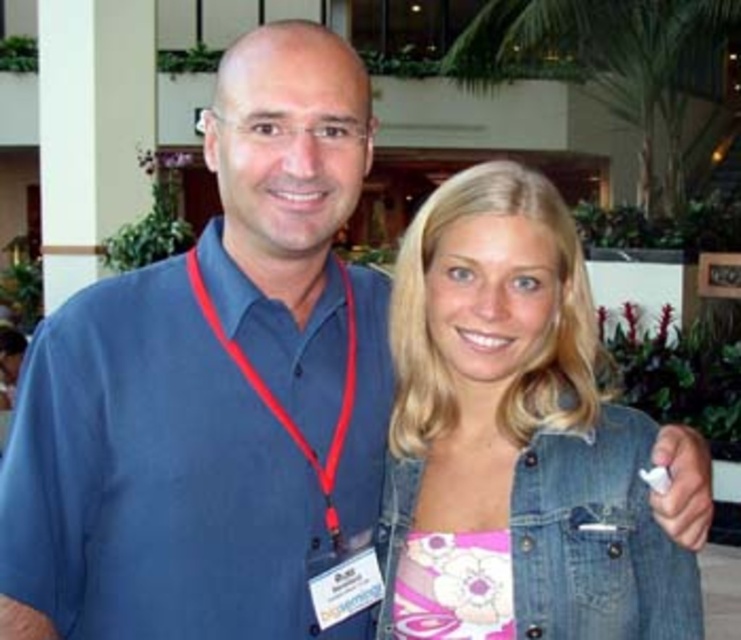
Question: Among these points, which one is nearest to the camera?

Choices:
 (A) pos(262,387)
 (B) pos(488,524)

Answer: (B)

Question: Does denim jacket at right lie in front of red fabric lanyard at center?

Choices:
 (A) yes
 (B) no

Answer: (A)

Question: Among these objects, which one is farthest from the camera?

Choices:
 (A) red fabric lanyard at center
 (B) denim jacket at right

Answer: (A)

Question: Can you confirm if denim jacket at right is smaller than red fabric lanyard at center?

Choices:
 (A) yes
 (B) no

Answer: (B)

Question: Where is denim jacket at right located in relation to red fabric lanyard at center in the image?

Choices:
 (A) left
 (B) right

Answer: (B)